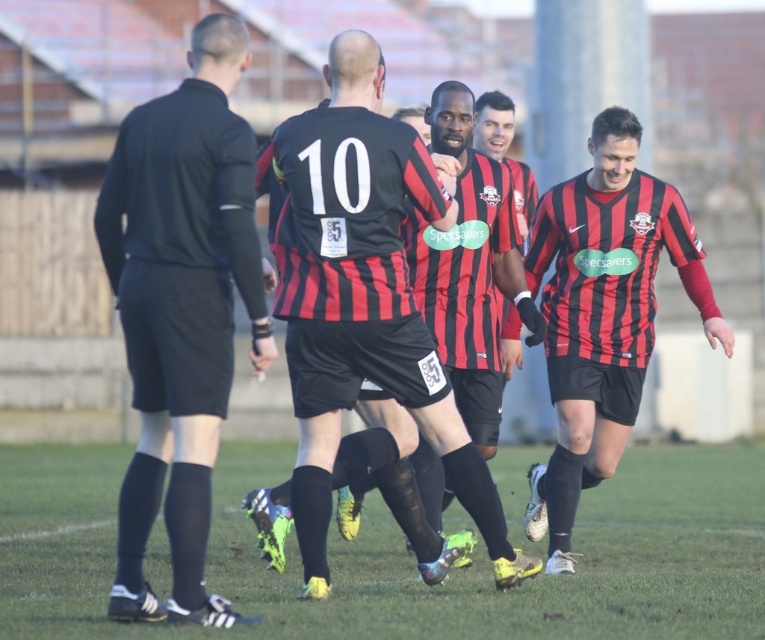
In the scene shown: You are a soccer player standing at the edge of the field. You need to quickly move to the green grass at lower center and the black matte referee at left. Which object is closer to you based on their sizes?

The green grass at lower center is larger in size than the black matte referee at left, so it is closer to you.

You are a soccer player standing at the point with coordinates point (404, 556). What surface are you currently standing on?

The point (404, 556) is on green grass at lower center, so you are standing on green grass.

You are a soccer player standing at the point with coordinates point (x=173, y=124). You need to pass the ball to your teammate located at point (x=565, y=372). Is there a clear path for the ball to travel directly between these two points without any obstacles?

The point (x=173, y=124) is in front of point (x=565, y=372), so the ball can travel directly between them without any obstacles.